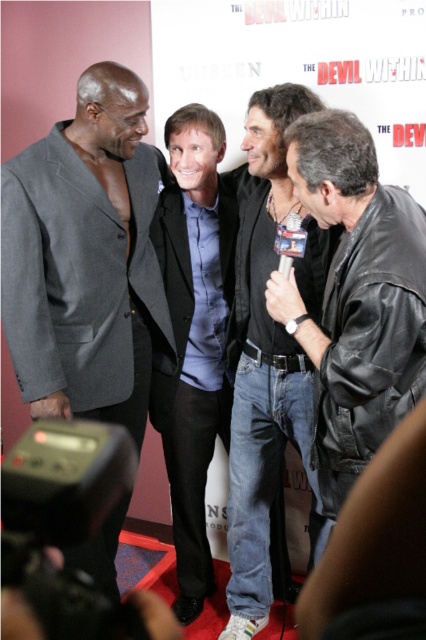
Question: Does jeans at center appear on the right side of matte black suit at center?

Choices:
 (A) yes
 (B) no

Answer: (A)

Question: Which point is closer to the camera taking this photo?

Choices:
 (A) (187, 548)
 (B) (333, 157)

Answer: (B)

Question: Does jeans at center appear over matte black suit at center?

Choices:
 (A) yes
 (B) no

Answer: (B)

Question: Which of these objects is positioned farthest from the gray wool suit at left?

Choices:
 (A) black leather jacket at right
 (B) matte black suit at center
 (C) jeans at center

Answer: (A)

Question: Based on their relative distances, which object is farther from the jeans at center?

Choices:
 (A) gray wool suit at left
 (B) black leather jacket at right

Answer: (A)

Question: Does black leather jacket at right have a smaller size compared to matte black suit at center?

Choices:
 (A) no
 (B) yes

Answer: (B)